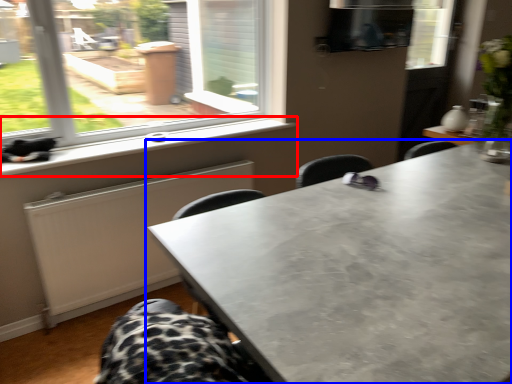
Question: Which object appears farthest to the camera in this image, window sill (highlighted by a red box) or table (highlighted by a blue box)?

Choices:
 (A) window sill
 (B) table

Answer: (A)